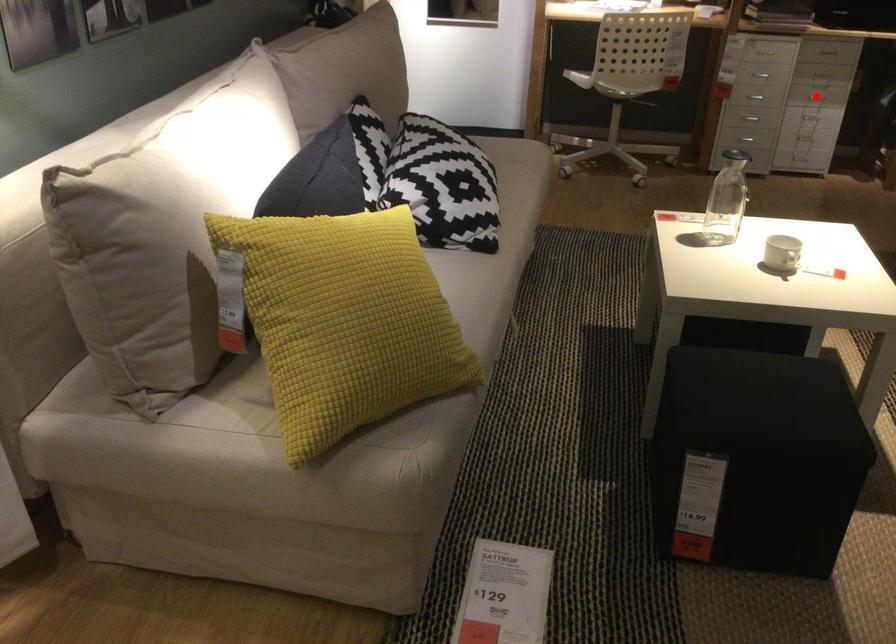
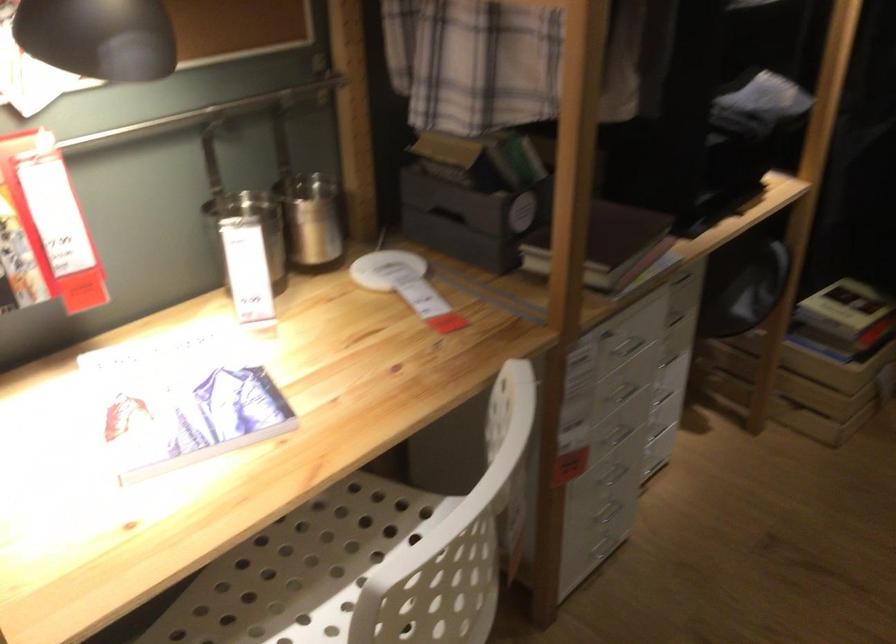
Question: I am providing you with two images of the same scene from different viewpoints. A red point is marked on the first image. Is the red point's position out of view in image 2?

Choices:
 (A) Yes
 (B) No

Answer: (A)